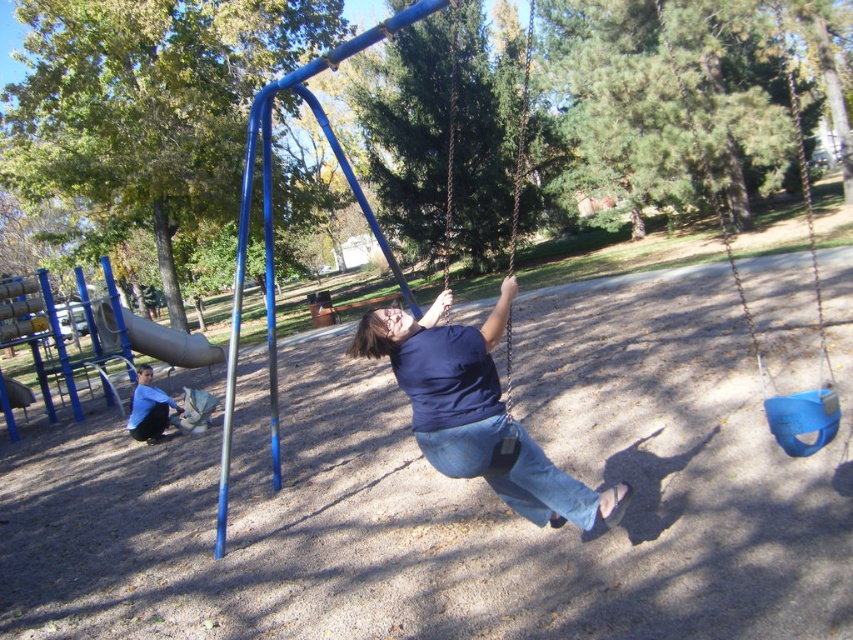
Question: Which point is closer to the camera taking this photo?

Choices:
 (A) (573, 480)
 (B) (16, 404)
 (C) (792, 419)
 (D) (386, 332)

Answer: (D)

Question: Can you confirm if dark blue fabric at center is thinner than denim at center?

Choices:
 (A) yes
 (B) no

Answer: (B)

Question: Does dark blue fabric at center come in front of brushed metal slide at left?

Choices:
 (A) yes
 (B) no

Answer: (A)

Question: Is dark blue fabric at center smaller than blue plastic swing at upper right?

Choices:
 (A) no
 (B) yes

Answer: (B)

Question: Which of the following is the closest to the observer?

Choices:
 (A) blue plastic swing at upper right
 (B) smooth gray slide at center-left
 (C) brushed metal slide at left

Answer: (A)

Question: Which point is closer to the camera?

Choices:
 (A) blue plastic swing at upper right
 (B) denim at center

Answer: (B)